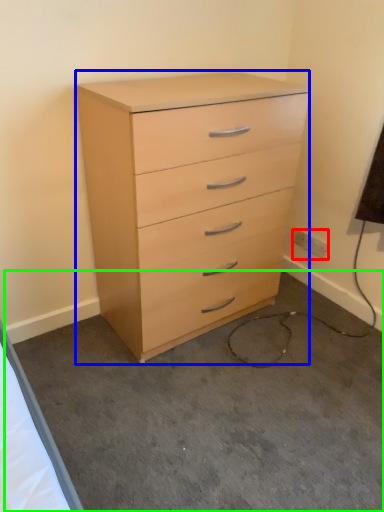
Question: Based on their relative distances, which object is farther from electric outlet (highlighted by a red box)? Choose from chest of drawers (highlighted by a blue box) and concrete (highlighted by a green box).

Choices:
 (A) chest of drawers
 (B) concrete

Answer: (B)